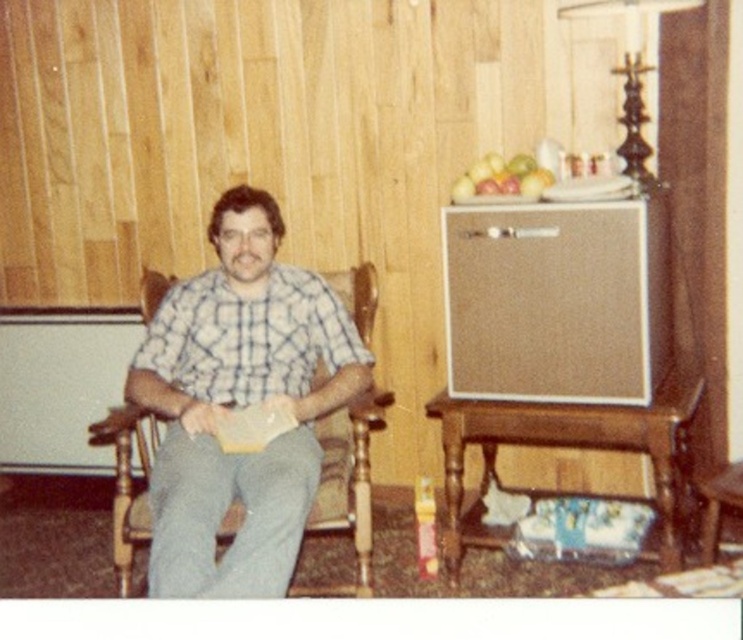
Does checkered fabric shirt at center appear over green matte apple at upper center?

Incorrect, checkered fabric shirt at center is not positioned above green matte apple at upper center.

Can you confirm if checkered fabric shirt at center is positioned to the left of green matte apple at upper center?

Indeed, checkered fabric shirt at center is positioned on the left side of green matte apple at upper center.

Where is `checkered fabric shirt at center`? The height and width of the screenshot is (640, 743). checkered fabric shirt at center is located at coordinates (239, 404).